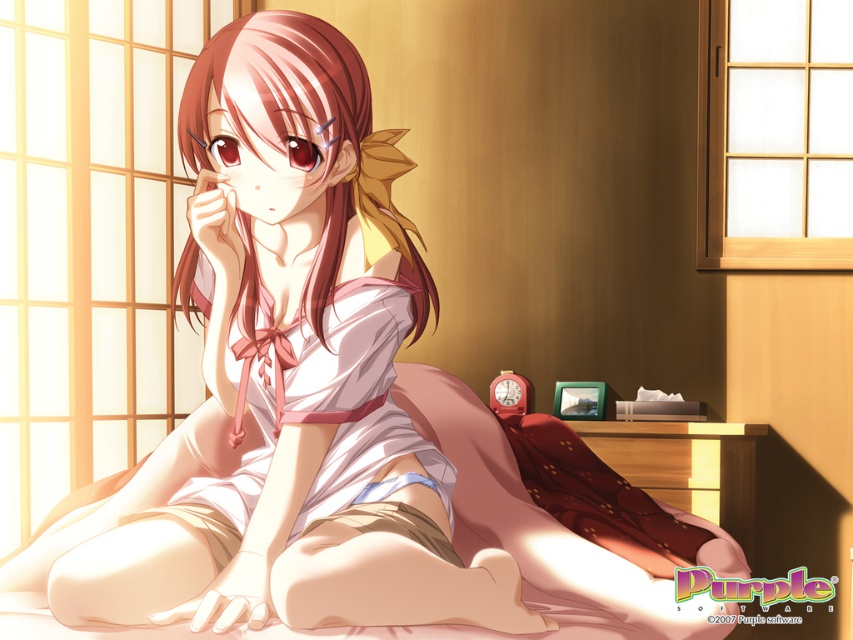
Question: Which point appears farthest from the camera in this image?

Choices:
 (A) (548, 532)
 (B) (398, 406)

Answer: (A)

Question: Can you confirm if smooth white dress at center is bigger than soft pink fabric bed at lower center?

Choices:
 (A) yes
 (B) no

Answer: (A)

Question: Can you confirm if smooth white dress at center is smaller than soft pink fabric bed at lower center?

Choices:
 (A) yes
 (B) no

Answer: (B)

Question: Does smooth white dress at center have a larger size compared to soft pink fabric bed at lower center?

Choices:
 (A) no
 (B) yes

Answer: (B)